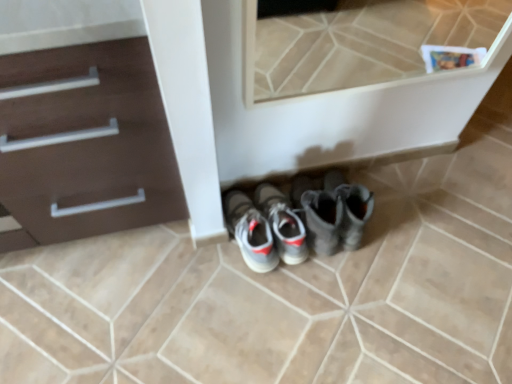
The image size is (512, 384). What are the coordinates of `free space to the left of gray fabric sneakers at center` in the screenshot? It's located at (185, 260).